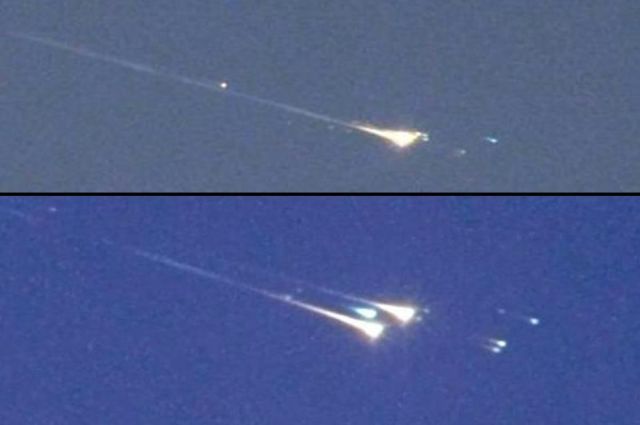
The image size is (640, 425). I want to click on 3 big lights in bottom image, so click(370, 339), click(364, 312), click(399, 319).